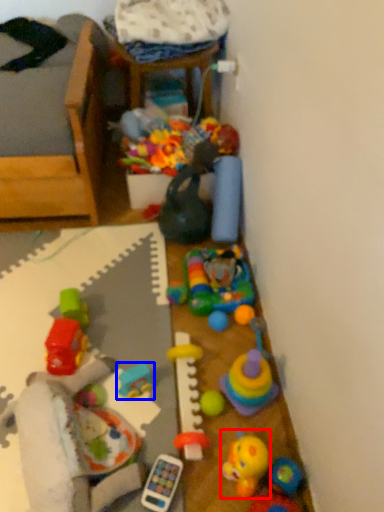
Question: Which object appears farthest to the camera in this image, toy (highlighted by a red box) or toy (highlighted by a blue box)?

Choices:
 (A) toy
 (B) toy

Answer: (B)